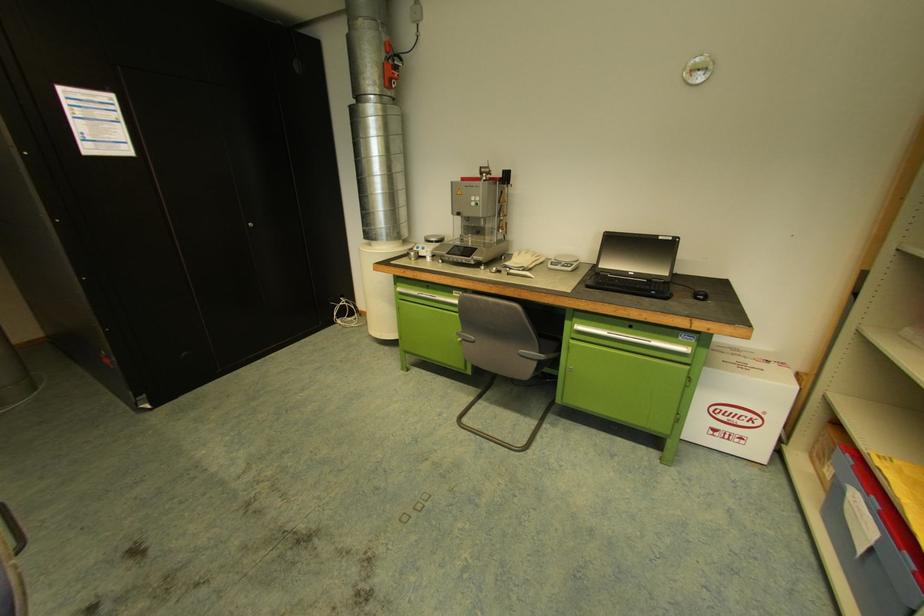
Locate an element on the screen. The height and width of the screenshot is (616, 924). blue circular button is located at coordinates (699, 294).